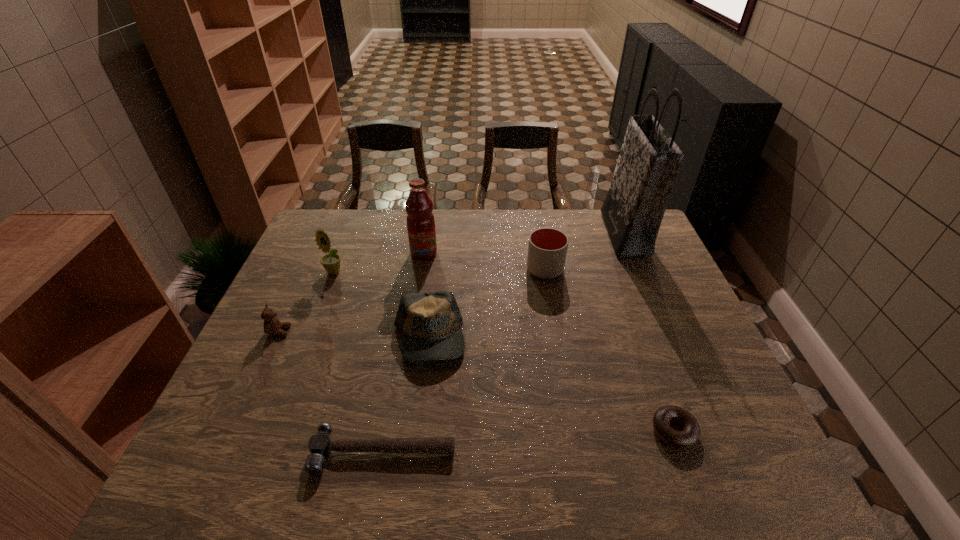
Where is `free space located on the front of the tallest object with the design`? The height and width of the screenshot is (540, 960). free space located on the front of the tallest object with the design is located at coordinates (543, 233).

Where is `free space located 0.070m on the front of the tallest object with the design`? free space located 0.070m on the front of the tallest object with the design is located at coordinates (588, 233).

This screenshot has height=540, width=960. Identify the location of vacant area located 0.260m on the front of the tallest object with the design. (532, 233).

The image size is (960, 540). Identify the location of vacant area situated on the front label of the fruit juice. (409, 347).

The height and width of the screenshot is (540, 960). I want to click on free space located on the face of the sunflower, so click(291, 384).

This screenshot has width=960, height=540. What are the coordinates of `vacant space located 0.120m on the right of the fifth shortest object` in the screenshot? It's located at (602, 269).

Find the location of a particular element. The height and width of the screenshot is (540, 960). free space located 0.270m on the front-facing side of the baseball cap is located at coordinates (413, 481).

Identify the location of vacant space located 0.400m on the face of the leftmost object. (440, 331).

I want to click on vacant space located on the left of the doughnut, so click(x=481, y=431).

Find the location of `shopping bag that is at the far edge`. shopping bag that is at the far edge is located at coordinates (649, 161).